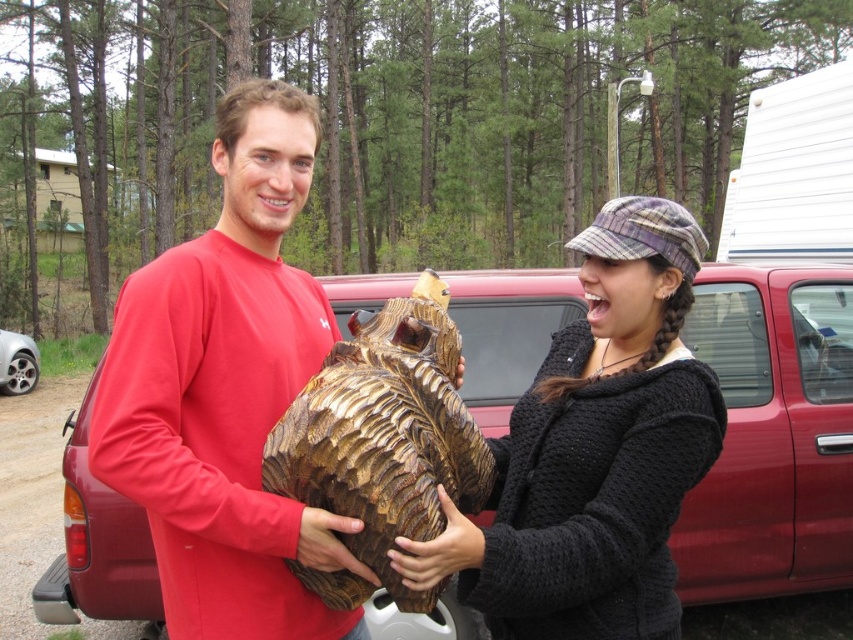
You are standing in the forest and want to take a photo of the metallic red truck at center and the black knitted sweater at center. Which object should you focus on first to ensure both are in the frame?

You should focus on the metallic red truck at center first because it is closer to you than the black knitted sweater at center, ensuring both are in the frame.

You are a photographer trying to capture a group photo of the two people holding the wooden carving at center. You want to position them so that the metallic red truck at center is visible in the background. Based on their current positions, should you move the people to the left or right to ensure the truck is in the frame?

The metallic red truck at center is to the right of the wooden carving at center. To include the truck in the background while keeping the wooden carving at center in the foreground, you should move the people to the left so that the truck remains visible to their right side.

Based on the photo, you are standing in front of the scene described. You need to locate the matte red shirt at center. Where exactly is it positioned in terms of coordinates?

The matte red shirt at center is positioned at coordinates point (225, 392).